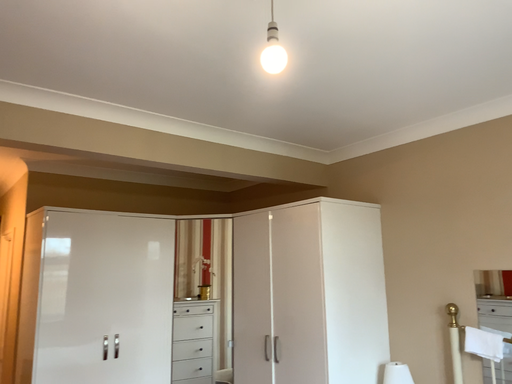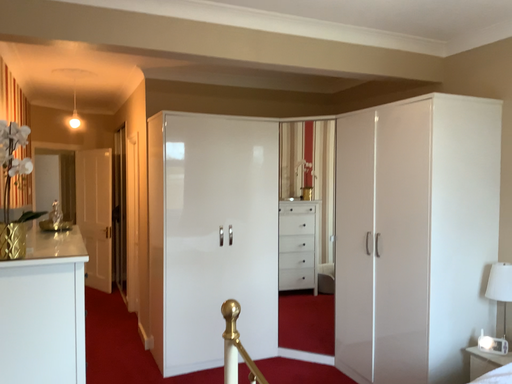
Question: Which way did the camera rotate in the video?

Choices:
 (A) rotated right
 (B) rotated left

Answer: (B)